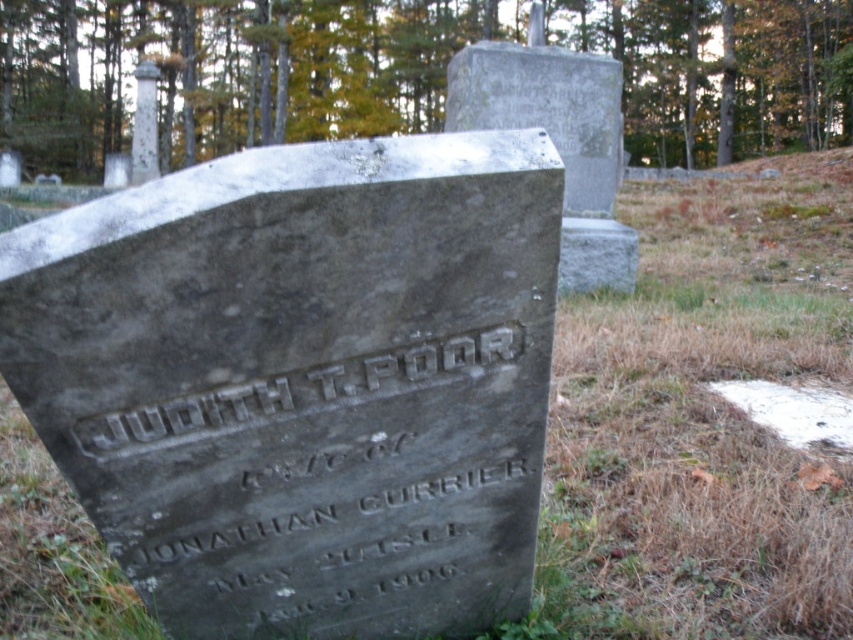
Which is behind, point (368, 58) or point (502, 339)?

Point (368, 58)

Measure the distance between point (722, 122) and camera.

Point (722, 122) is 39.52 meters from camera.

Between point (93, 161) and point (241, 429), which one is positioned behind?

The point (93, 161) is more distant.

Locate an element on the screen. The image size is (853, 640). green leafy tree at upper center is located at coordinates (229, 72).